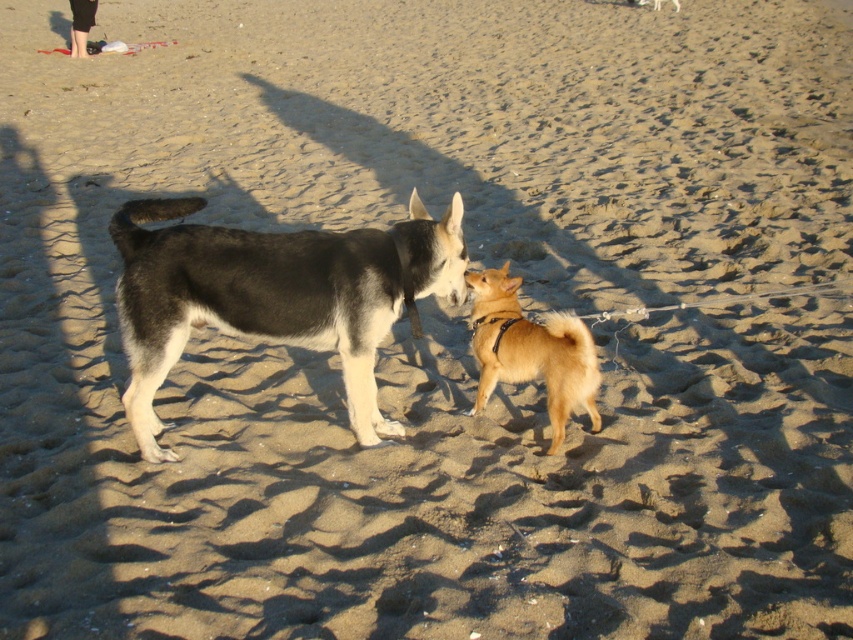
Between point (550, 380) and point (91, 26), which one is positioned in front?

Positioned in front is point (550, 380).

Is golden fur dog at center shorter than black leather pants at upper left?

Yes.

Between point (489, 339) and point (90, 22), which one is positioned behind?

Point (90, 22)

Where is `golden fur dog at center`? The width and height of the screenshot is (853, 640). golden fur dog at center is located at coordinates (531, 349).

Measure the distance between black and white fur dog at center and camera.

A distance of 2.91 meters exists between black and white fur dog at center and camera.

Which of these two, black and white fur dog at center or golden fur dog at center, stands taller?

With more height is black and white fur dog at center.

The height and width of the screenshot is (640, 853). What do you see at coordinates (273, 296) in the screenshot? I see `black and white fur dog at center` at bounding box center [273, 296].

Locate an element on the screen. This screenshot has width=853, height=640. black and white fur dog at center is located at coordinates (273, 296).

Between black and white fur dog at center and black leather pants at upper left, which one appears on the right side from the viewer's perspective?

black and white fur dog at center

Describe the element at coordinates (273, 296) in the screenshot. I see `black and white fur dog at center` at that location.

Does point (142, 246) come farther from viewer compared to point (86, 4)?

No.

Find the location of a particular element. black and white fur dog at center is located at coordinates (273, 296).